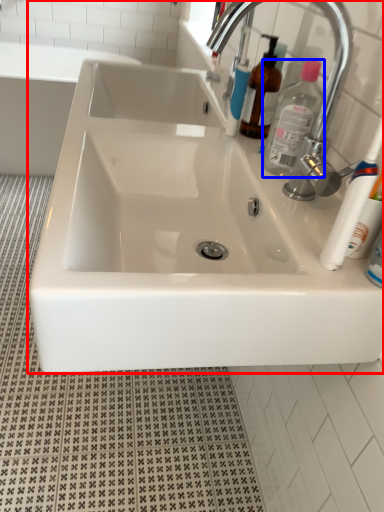
Question: Which object is further to the camera taking this photo, sink (highlighted by a red box) or cleaning product (highlighted by a blue box)?

Choices:
 (A) sink
 (B) cleaning product

Answer: (B)